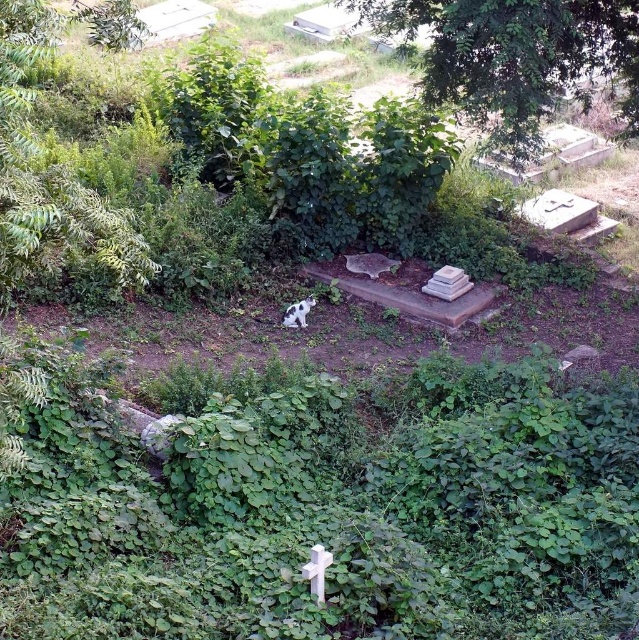
Question: Which point is farther from the camera taking this photo?

Choices:
 (A) (535, 81)
 (B) (217, 506)
 (C) (298, 308)

Answer: (C)

Question: Which object is closer to the camera taking this photo?

Choices:
 (A) spotted fur cat at center
 (B) green leafy plants at center
 (C) green leafy tree at upper center

Answer: (B)

Question: Which point is farther to the camera?

Choices:
 (A) (553, 452)
 (B) (298, 310)
 (C) (488, 108)

Answer: (C)

Question: Is green leafy plants at center to the left of green leafy tree at upper center from the viewer's perspective?

Choices:
 (A) no
 (B) yes

Answer: (B)

Question: Is green leafy plants at center to the right of green leafy tree at upper center from the viewer's perspective?

Choices:
 (A) yes
 (B) no

Answer: (B)

Question: Does green leafy tree at upper center have a lesser width compared to spotted fur cat at center?

Choices:
 (A) yes
 (B) no

Answer: (B)